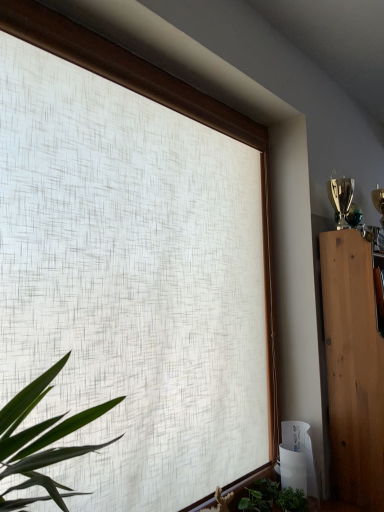
Question: From the image's perspective, is green matte plant at lower right located above or below green leafy plant at lower center?

Choices:
 (A) above
 (B) below

Answer: (A)

Question: Considering the positions of green matte plant at lower right and green leafy plant at lower center in the image, is green matte plant at lower right taller or shorter than green leafy plant at lower center?

Choices:
 (A) short
 (B) tall

Answer: (B)

Question: Which object is the closest to the green matte plant at lower right?

Choices:
 (A) green leafy plant at lower center
 (B) light brown wood cabinet at right

Answer: (A)

Question: Which object is positioned closest to the green leafy plant at lower center?

Choices:
 (A) light brown wood cabinet at right
 (B) green matte plant at lower right

Answer: (B)